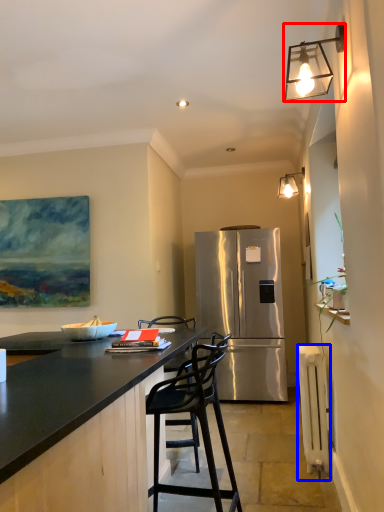
Question: Which object appears closest to the camera in this image, lamp (highlighted by a red box) or radiator (highlighted by a blue box)?

Choices:
 (A) lamp
 (B) radiator

Answer: (A)